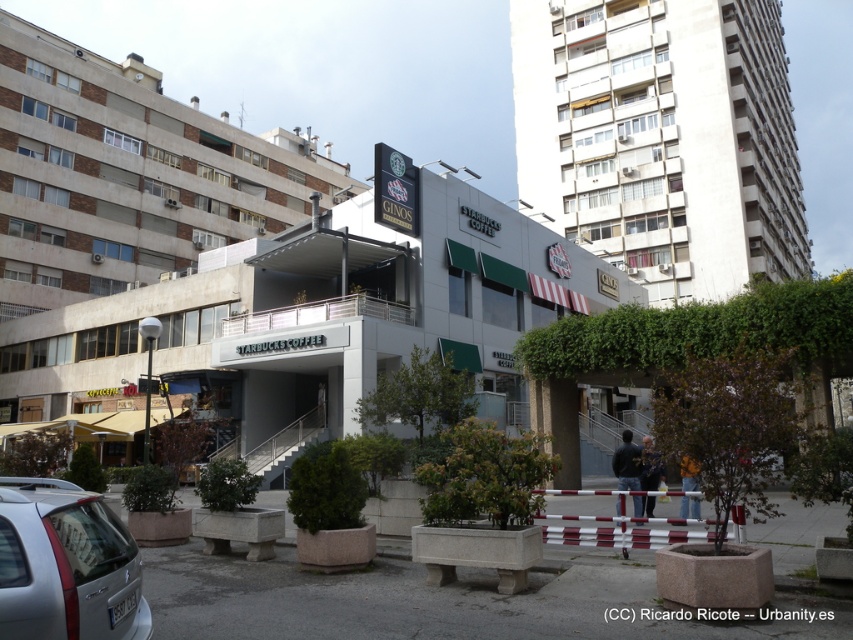
Question: Does white concrete building at upper right lie behind silver metallic car at lower left?

Choices:
 (A) yes
 (B) no

Answer: (A)

Question: Which of the following is the farthest from the observer?

Choices:
 (A) white concrete building at upper right
 (B) silver metallic car at lower left

Answer: (A)

Question: Which of the following is the farthest from the observer?

Choices:
 (A) (790, 100)
 (B) (93, 566)

Answer: (A)

Question: Which object is farther from the camera taking this photo?

Choices:
 (A) white concrete building at upper right
 (B) white concrete building at center
 (C) silver metallic car at lower left

Answer: (A)

Question: Can you confirm if white concrete building at center is bigger than white concrete building at upper right?

Choices:
 (A) yes
 (B) no

Answer: (B)

Question: Is white concrete building at center to the right of silver metallic car at lower left from the viewer's perspective?

Choices:
 (A) yes
 (B) no

Answer: (A)